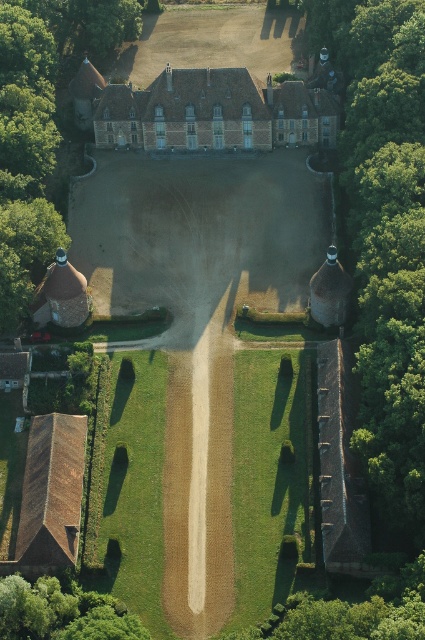
Can you confirm if brown brick mansion at center is positioned to the left of green leafy tree at lower left?

In fact, brown brick mansion at center is to the right of green leafy tree at lower left.

The image size is (425, 640). What are the coordinates of `brown brick mansion at center` in the screenshot? It's located at (215, 113).

The width and height of the screenshot is (425, 640). I want to click on brown brick mansion at center, so click(x=215, y=113).

Is point (62, 42) more distant than point (181, 122)?

Yes.

Is green leafy tree at upper left to the right of brown brick mansion at center from the viewer's perspective?

In fact, green leafy tree at upper left is to the left of brown brick mansion at center.

Locate an element on the screen. green leafy tree at upper left is located at coordinates (39, 125).

Where is `green leafy tree at upper left`? This screenshot has height=640, width=425. green leafy tree at upper left is located at coordinates (39, 125).

Can you confirm if green leafy tree at upper left is bigger than green leafy tree at lower left?

Indeed, green leafy tree at upper left has a larger size compared to green leafy tree at lower left.

Does green leafy tree at upper left have a greater width compared to green leafy tree at lower left?

Yes, green leafy tree at upper left is wider than green leafy tree at lower left.

What do you see at coordinates (39, 125) in the screenshot? This screenshot has width=425, height=640. I see `green leafy tree at upper left` at bounding box center [39, 125].

Find the location of a particular element. green leafy tree at upper left is located at coordinates (39, 125).